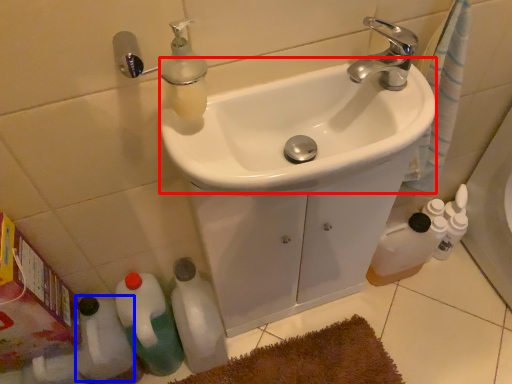
Question: Among these objects, which one is nearest to the camera, sink (highlighted by a red box) or bottle (highlighted by a blue box)?

Choices:
 (A) sink
 (B) bottle

Answer: (A)